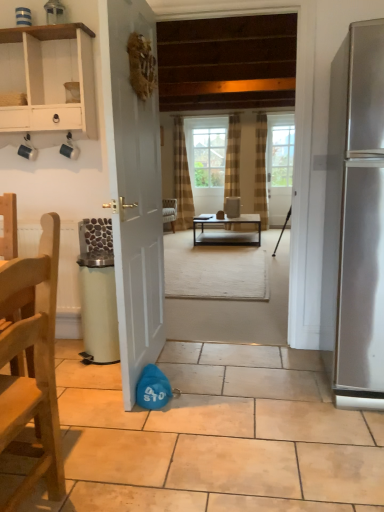
Question: Considering the relative sizes of brown textured curtain at center and white matte door at center, which ranks as the 1th door in left-to-right order, in the image provided, is brown textured curtain at center taller than white matte door at center, which ranks as the 1th door in left-to-right order,?

Choices:
 (A) no
 (B) yes

Answer: (B)

Question: Is brown textured curtain at center at the right side of white matte door at center, which ranks as the 1th door in left-to-right order?

Choices:
 (A) yes
 (B) no

Answer: (A)

Question: Considering the relative sizes of brown textured curtain at center and white matte door at center, which ranks as the 1th door in left-to-right order, in the image provided, is brown textured curtain at center shorter than white matte door at center, which ranks as the 1th door in left-to-right order,?

Choices:
 (A) no
 (B) yes

Answer: (A)

Question: From the image's perspective, is brown textured curtain at center over white matte door at center, the second door positioned from the right?

Choices:
 (A) no
 (B) yes

Answer: (B)

Question: Would you say white matte door at center, placed as the first door when sorted from front to back, is part of brown textured curtain at center's contents?

Choices:
 (A) no
 (B) yes

Answer: (A)

Question: Is wooden chair at left situated inside wooden floor at center or outside?

Choices:
 (A) outside
 (B) inside

Answer: (A)

Question: Looking at the image, does wooden chair at left seem bigger or smaller compared to wooden floor at center?

Choices:
 (A) small
 (B) big

Answer: (A)

Question: Is point (46, 237) positioned closer to the camera than point (264, 111)?

Choices:
 (A) farther
 (B) closer

Answer: (B)

Question: Is wooden chair at left wider or thinner than wooden floor at center?

Choices:
 (A) wide
 (B) thin

Answer: (A)

Question: From the image's perspective, is wooden chair at left located above or below green matte trash can at lower left?

Choices:
 (A) above
 (B) below

Answer: (B)

Question: Is wooden chair at left bigger or smaller than green matte trash can at lower left?

Choices:
 (A) small
 (B) big

Answer: (B)

Question: Is point (34, 369) closer or farther from the camera than point (110, 271)?

Choices:
 (A) closer
 (B) farther

Answer: (A)

Question: Is wooden chair at left taller or shorter than green matte trash can at lower left?

Choices:
 (A) short
 (B) tall

Answer: (B)

Question: Considering the positions of brown textured curtain at center and wooden chair at left in the image, is brown textured curtain at center bigger or smaller than wooden chair at left?

Choices:
 (A) small
 (B) big

Answer: (B)

Question: Is brown textured curtain at center in front of or behind wooden chair at left in the image?

Choices:
 (A) front
 (B) behind

Answer: (B)